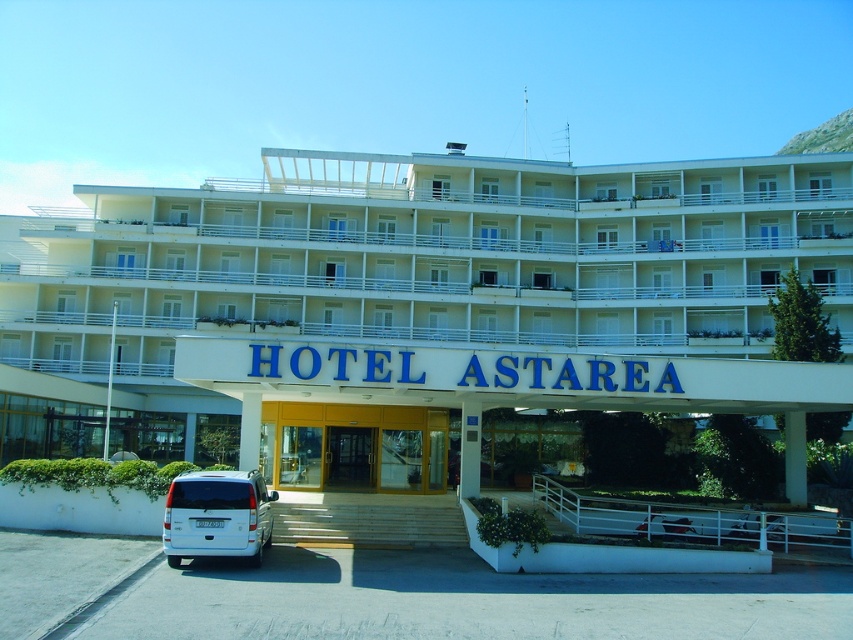
Question: Considering the relative positions of white glossy building at center and white matte van at lower left in the image provided, where is white glossy building at center located with respect to white matte van at lower left?

Choices:
 (A) above
 (B) below

Answer: (A)

Question: Which point is farther from the camera taking this photo?

Choices:
 (A) (231, 474)
 (B) (355, 442)

Answer: (B)

Question: Is white matte van at lower left positioned behind wooden door at center?

Choices:
 (A) no
 (B) yes

Answer: (A)

Question: Which of the following is the farthest from the observer?

Choices:
 (A) white glossy building at center
 (B) white matte van at lower left
 (C) wooden door at center

Answer: (C)

Question: Does white matte van at lower left have a larger size compared to wooden door at center?

Choices:
 (A) no
 (B) yes

Answer: (A)

Question: Which point is closer to the camera taking this photo?

Choices:
 (A) (341, 429)
 (B) (722, 218)
 (C) (223, 477)

Answer: (C)